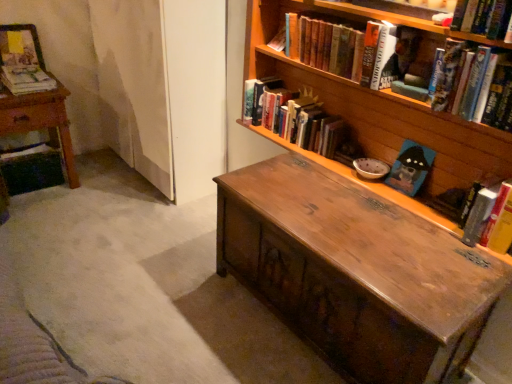
Question: Considering the relative sizes of hardcover book at upper right, arranged as the sixth book when viewed from the left, and matte paper magazine at upper left, the 1th book from the left, in the image provided, is hardcover book at upper right, arranged as the sixth book when viewed from the left, shorter than matte paper magazine at upper left, the 1th book from the left,?

Choices:
 (A) no
 (B) yes

Answer: (B)

Question: Can you confirm if hardcover book at upper right, arranged as the sixth book when viewed from the left, is positioned to the left of matte paper magazine at upper left, which is counted as the seventh book, starting from the right?

Choices:
 (A) yes
 (B) no

Answer: (B)

Question: Is hardcover book at upper right, which is the second book in right-to-left order, further to camera compared to matte paper magazine at upper left, which is counted as the seventh book, starting from the right?

Choices:
 (A) yes
 (B) no

Answer: (B)

Question: From the image's perspective, is hardcover book at upper right, arranged as the sixth book when viewed from the left, on top of matte paper magazine at upper left, the 1th book from the left?

Choices:
 (A) no
 (B) yes

Answer: (A)

Question: From a real-world perspective, is hardcover book at upper right, arranged as the sixth book when viewed from the left, positioned under matte paper magazine at upper left, the 1th book from the left, based on gravity?

Choices:
 (A) yes
 (B) no

Answer: (B)

Question: Is wooden bookcase at upper right taller or shorter than hardcover book at right, the seventh book in the left-to-right sequence?

Choices:
 (A) tall
 (B) short

Answer: (A)

Question: Is wooden bookcase at upper right spatially inside hardcover book at right, the seventh book in the left-to-right sequence, or outside of it?

Choices:
 (A) outside
 (B) inside

Answer: (A)

Question: Looking at the image, does wooden bookcase at upper right seem bigger or smaller compared to hardcover book at right, the seventh book in the left-to-right sequence?

Choices:
 (A) small
 (B) big

Answer: (B)

Question: In terms of width, does wooden bookcase at upper right look wider or thinner when compared to hardcover book at right, which is counted as the first book, starting from the right?

Choices:
 (A) wide
 (B) thin

Answer: (A)

Question: From a real-world perspective, is hardcover book at upper center, the fourth book when ordered from right to left, above or below hardcover book at right, which is counted as the first book, starting from the right?

Choices:
 (A) above
 (B) below

Answer: (A)

Question: Considering their positions, is hardcover book at upper center, the fourth book when ordered from right to left, located in front of or behind hardcover book at right, the seventh book in the left-to-right sequence?

Choices:
 (A) behind
 (B) front

Answer: (A)

Question: Is hardcover book at upper center, marked as the fourth book in a left-to-right arrangement, inside or outside of hardcover book at right, the seventh book in the left-to-right sequence?

Choices:
 (A) inside
 (B) outside

Answer: (B)

Question: Considering the positions of hardcover book at upper center, the fourth book when ordered from right to left, and hardcover book at right, the seventh book in the left-to-right sequence, in the image, is hardcover book at upper center, the fourth book when ordered from right to left, taller or shorter than hardcover book at right, the seventh book in the left-to-right sequence,?

Choices:
 (A) tall
 (B) short

Answer: (B)

Question: Would you say matte paper magazine at upper left, the 1th book from the left, is to the left or to the right of matte paper book at left, the 6th book when ordered from right to left, in the picture?

Choices:
 (A) left
 (B) right

Answer: (A)

Question: From the image's perspective, is matte paper magazine at upper left, the 1th book from the left, positioned above or below matte paper book at left, which appears as the 2th book when viewed from the left?

Choices:
 (A) below
 (B) above

Answer: (B)